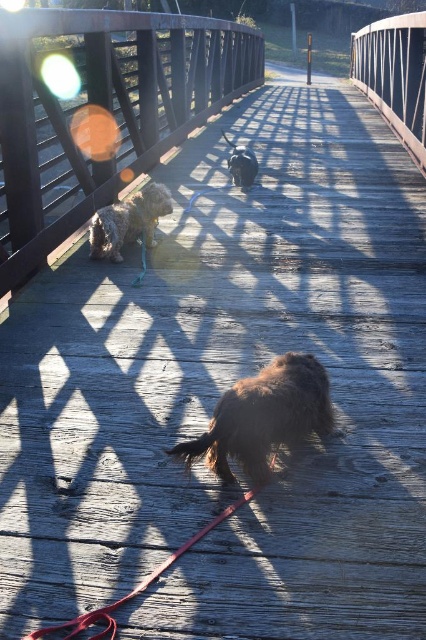
Question: Which object is farther from the camera taking this photo?

Choices:
 (A) fuzzy brown dog at center
 (B) brown furry dog at center

Answer: (A)

Question: Can you confirm if fuzzy brown dog at center is thinner than shiny black dog at center?

Choices:
 (A) no
 (B) yes

Answer: (A)

Question: Which of the following is the farthest from the observer?

Choices:
 (A) (242, 394)
 (B) (250, 179)
 (C) (83, 625)

Answer: (B)

Question: Does brown furry dog at center come behind red leather leash at lower center?

Choices:
 (A) yes
 (B) no

Answer: (A)

Question: Among these objects, which one is nearest to the camera?

Choices:
 (A) fuzzy brown dog at center
 (B) red leather leash at lower center

Answer: (B)

Question: Does fuzzy brown dog at center appear on the left side of shiny black dog at center?

Choices:
 (A) yes
 (B) no

Answer: (A)